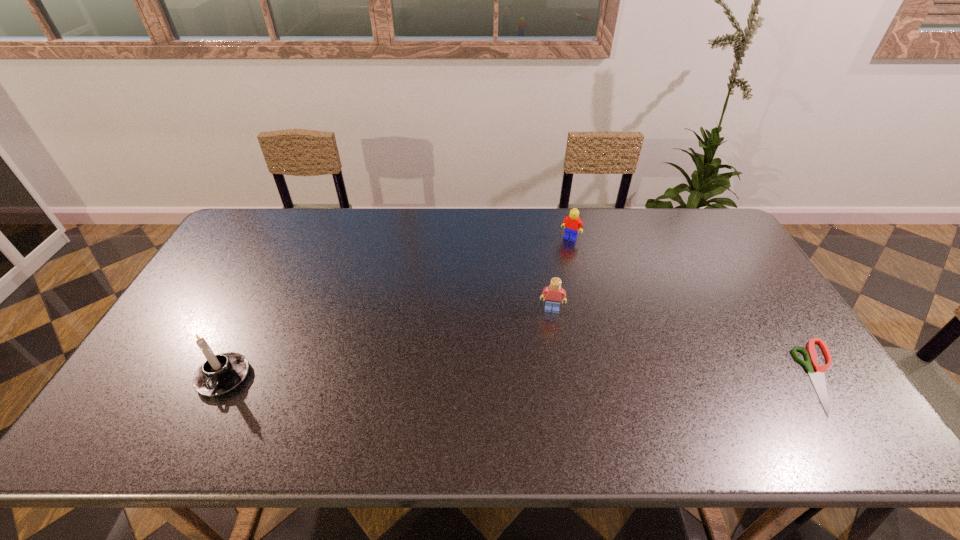
Locate an element on the screen. the tallest object is located at coordinates (221, 373).

Where is `the leftmost object`? The height and width of the screenshot is (540, 960). the leftmost object is located at coordinates (221, 373).

Where is `scissors`? The height and width of the screenshot is (540, 960). scissors is located at coordinates (818, 379).

At what (x,y) coordinates should I click in order to perform the action: click on the shortest object. Please return your answer as a coordinate pair (x, y). The image size is (960, 540). Looking at the image, I should click on (818, 379).

At what (x,y) coordinates should I click in order to perform the action: click on the second object from left to right. Please return your answer as a coordinate pair (x, y). Looking at the image, I should click on (554, 293).

The height and width of the screenshot is (540, 960). I want to click on the left Lego, so click(554, 293).

What are the coordinates of `the second object from right to left` in the screenshot? It's located at (571, 223).

The width and height of the screenshot is (960, 540). In order to click on the farther Lego in this screenshot , I will do `click(571, 223)`.

Locate an element on the screen. vacant space situated on the left of the shortest object is located at coordinates [754, 376].

Identify the location of free location located 0.130m on the front-facing side of the third nearest object. The height and width of the screenshot is (540, 960). (546, 349).